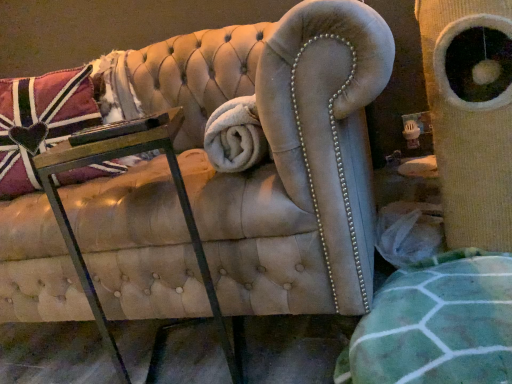
Question: Are metal/glass table at lower left and velvet union jack pillow at upper left beside each other?

Choices:
 (A) no
 (B) yes

Answer: (A)

Question: From a real-world perspective, is metal/glass table at lower left located higher than velvet union jack pillow at upper left?

Choices:
 (A) yes
 (B) no

Answer: (B)

Question: Is metal/glass table at lower left wider than velvet union jack pillow at upper left?

Choices:
 (A) no
 (B) yes

Answer: (B)

Question: Can you confirm if metal/glass table at lower left is thinner than velvet union jack pillow at upper left?

Choices:
 (A) no
 (B) yes

Answer: (A)

Question: Is metal/glass table at lower left positioned behind velvet union jack pillow at upper left?

Choices:
 (A) yes
 (B) no

Answer: (B)

Question: Is metal/glass table at lower left not close to velvet union jack pillow at upper left?

Choices:
 (A) yes
 (B) no

Answer: (B)

Question: From the image's perspective, is velvet union jack pillow at upper left located beneath metal/glass table at lower left?

Choices:
 (A) no
 (B) yes

Answer: (A)

Question: Can you confirm if velvet union jack pillow at upper left is positioned to the right of metal/glass table at lower left?

Choices:
 (A) no
 (B) yes

Answer: (A)

Question: From a real-world perspective, does velvet union jack pillow at upper left sit lower than metal/glass table at lower left?

Choices:
 (A) no
 (B) yes

Answer: (A)

Question: Considering the relative positions of velvet union jack pillow at upper left and metal/glass table at lower left in the image provided, is velvet union jack pillow at upper left to the left of metal/glass table at lower left from the viewer's perspective?

Choices:
 (A) no
 (B) yes

Answer: (B)

Question: Considering the relative sizes of velvet union jack pillow at upper left and metal/glass table at lower left in the image provided, is velvet union jack pillow at upper left shorter than metal/glass table at lower left?

Choices:
 (A) no
 (B) yes

Answer: (B)

Question: Does velvet union jack pillow at upper left have a lesser width compared to metal/glass table at lower left?

Choices:
 (A) no
 (B) yes

Answer: (B)

Question: From their relative heights in the image, would you say metal/glass table at lower left is taller or shorter than velvet union jack pillow at upper left?

Choices:
 (A) short
 (B) tall

Answer: (B)